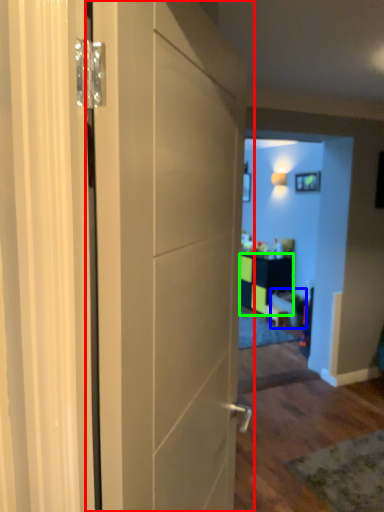
Question: Based on their relative distances, which object is farther from door (highlighted by a red box)? Choose from furniture (highlighted by a blue box) and cabinetry (highlighted by a green box).

Choices:
 (A) furniture
 (B) cabinetry

Answer: (B)